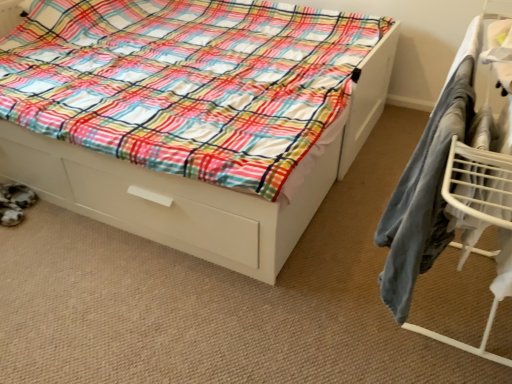
Identify the location of blank area beneath metal drying rack at right (from a real-world perspective). (444, 316).